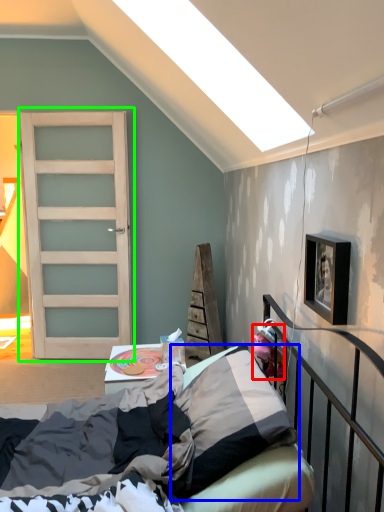
Question: Which object is positioned closest to toy (highlighted by a red box)? Select from pillow (highlighted by a blue box) and door (highlighted by a green box).

Choices:
 (A) pillow
 (B) door

Answer: (A)